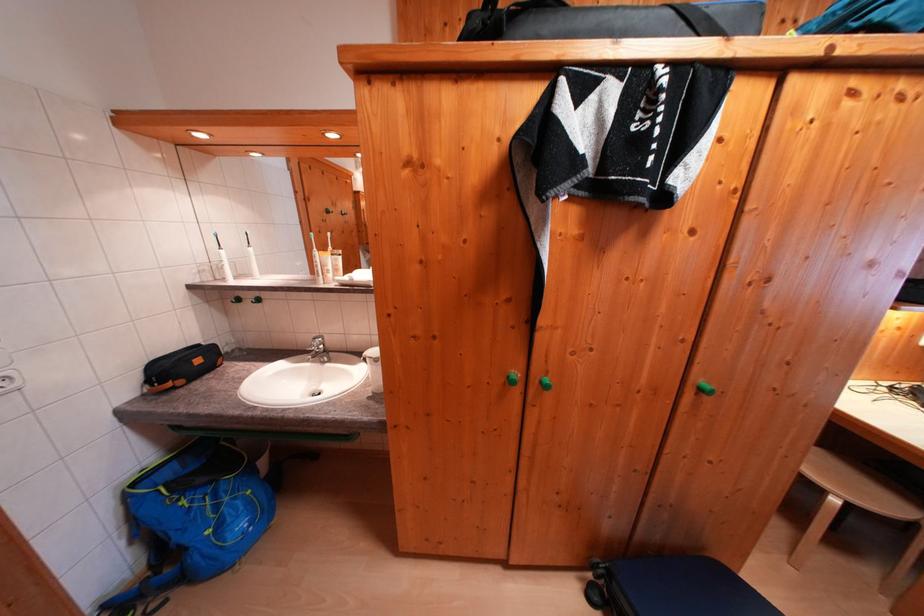
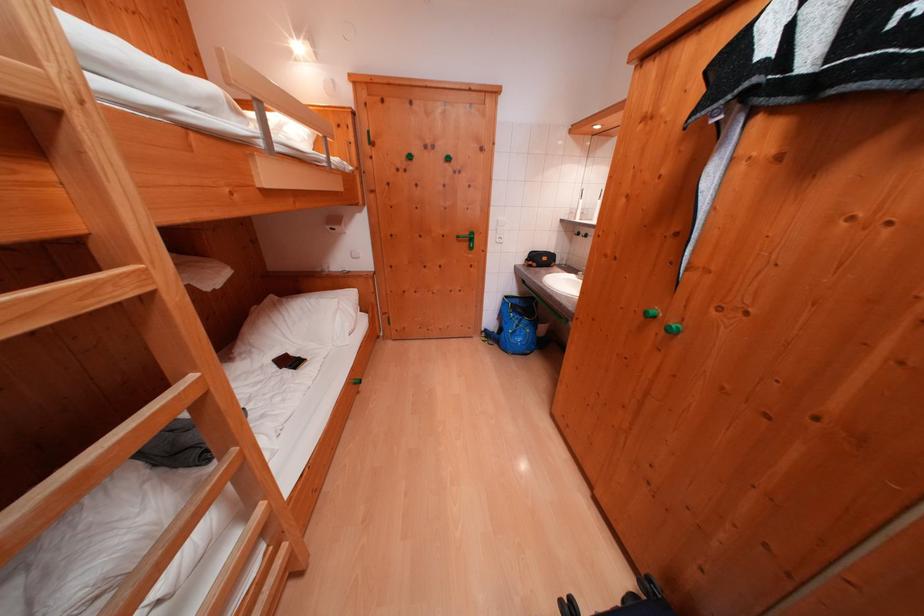
In the second image, find the point that corresponds to [142,488] in the first image.

(515, 301)